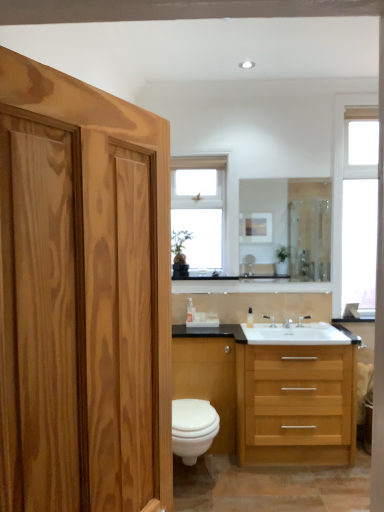
Identify the location of white plastic soap dispenser at center. Image resolution: width=384 pixels, height=512 pixels. (250, 318).

What do you see at coordinates (193, 428) in the screenshot?
I see `white glossy toilet at lower center` at bounding box center [193, 428].

The image size is (384, 512). What do you see at coordinates (266, 396) in the screenshot? I see `light wood/finish sink at lower right` at bounding box center [266, 396].

In order to face silver metallic faucet at sink right, marked as the second faucet in a left-to-right arrangement, should I rotate leftwards or rightwards?

Rotate right and turn 14.730 degrees.

Locate an element on the screen. The height and width of the screenshot is (512, 384). clear glass mirror at center is located at coordinates (286, 227).

The width and height of the screenshot is (384, 512). Describe the element at coordinates (200, 211) in the screenshot. I see `clear glass window at upper center, acting as the 2th window starting from the right` at that location.

At what (x,y) coordinates should I click in order to perform the action: click on white plastic soap dispenser at center. Please return your answer as a coordinate pair (x, y). Looking at the image, I should click on (250, 318).

From the image's perspective, is white glass window at upper right, the 1th window positioned from the right, under clear glass mirror at center?

Actually, white glass window at upper right, the 1th window positioned from the right, appears above clear glass mirror at center in the image.

In terms of width, does white glass window at upper right, which appears as the 2th window when viewed from the left, look wider or thinner when compared to clear glass mirror at center?

In the image, white glass window at upper right, which appears as the 2th window when viewed from the left, appears to be wider than clear glass mirror at center.

Is white glass window at upper right, the 1th window positioned from the right, positioned with its back to clear glass mirror at center?

white glass window at upper right, the 1th window positioned from the right, does not have its back to clear glass mirror at center.

Would you say white glass window at upper right, which appears as the 2th window when viewed from the left, contains clear glass mirror at center?

No, clear glass mirror at center is not inside white glass window at upper right, which appears as the 2th window when viewed from the left.

Considering the sizes of objects white plastic soap dispenser at center and silver metallic faucet at sink right, the 1th faucet viewed from the left, in the image provided, who is wider, white plastic soap dispenser at center or silver metallic faucet at sink right, the 1th faucet viewed from the left,?

With larger width is white plastic soap dispenser at center.

Considering the sizes of objects white plastic soap dispenser at center and silver metallic faucet at sink right, the 1th faucet viewed from the left, in the image provided, who is bigger, white plastic soap dispenser at center or silver metallic faucet at sink right, the 1th faucet viewed from the left,?

white plastic soap dispenser at center is bigger.

Considering the positions of point (253, 319) and point (263, 316), is point (253, 319) closer or farther from the camera than point (263, 316)?

Point (253, 319) is positioned closer to the camera compared to point (263, 316).

From a real-world perspective, is white plastic soap dispenser at center positioned under silver metallic faucet at sink right, the 1th faucet viewed from the left, based on gravity?

No.

Is silver metallic faucet at sink right, positioned as the second faucet in right-to-left order, completely or partially outside of white plastic soap dispenser at center?

That's correct, silver metallic faucet at sink right, positioned as the second faucet in right-to-left order, is outside of white plastic soap dispenser at center.

Is silver metallic faucet at sink right, the 1th faucet viewed from the left, at the left side of white plastic soap dispenser at center?

No, silver metallic faucet at sink right, the 1th faucet viewed from the left, is not to the left of white plastic soap dispenser at center.

Is silver metallic faucet at sink right, positioned as the second faucet in right-to-left order, positioned with its back to white plastic soap dispenser at center?

silver metallic faucet at sink right, positioned as the second faucet in right-to-left order, is not turned away from white plastic soap dispenser at center.

Locate an element on the screen. Image resolution: width=384 pixels, height=512 pixels. toiletry located behind the white glass window at upper right, the 1th window positioned from the right is located at coordinates (250, 318).

Looking at this image, considering the positions of objects white glass window at upper right, the 1th window positioned from the right, and white plastic soap dispenser at center in the image provided, who is in front, white glass window at upper right, the 1th window positioned from the right, or white plastic soap dispenser at center?

white glass window at upper right, the 1th window positioned from the right, is more forward.

Can you confirm if white glass window at upper right, which appears as the 2th window when viewed from the left, is positioned to the left of white plastic soap dispenser at center?

No, white glass window at upper right, which appears as the 2th window when viewed from the left, is not to the left of white plastic soap dispenser at center.

From a real-world perspective, is white glass window at upper right, which appears as the 2th window when viewed from the left, physically above white plastic soap dispenser at center?

Yes.

Based on the photo, does clear glass window at upper center, acting as the 2th window starting from the right, appear on the left side of white glass window at upper right, which appears as the 2th window when viewed from the left?

Yes, clear glass window at upper center, acting as the 2th window starting from the right, is to the left of white glass window at upper right, which appears as the 2th window when viewed from the left.

Is white glass window at upper right, the 1th window positioned from the right, inside clear glass window at upper center, the 1th window in the left-to-right sequence?

That's incorrect, white glass window at upper right, the 1th window positioned from the right, is not inside clear glass window at upper center, the 1th window in the left-to-right sequence.

Can you tell me how much clear glass window at upper center, the 1th window in the left-to-right sequence, and white glass window at upper right, the 1th window positioned from the right, differ in facing direction?

The angular difference between clear glass window at upper center, the 1th window in the left-to-right sequence, and white glass window at upper right, the 1th window positioned from the right, is 0.744 degrees.

Between clear glass window at upper center, acting as the 2th window starting from the right, and white glass window at upper right, the 1th window positioned from the right, which one is positioned in front?

white glass window at upper right, the 1th window positioned from the right.

Which object is more forward, clear glass mirror at center or silver metallic faucet at sink right, which appears as the first faucet when viewed from the right?

silver metallic faucet at sink right, which appears as the first faucet when viewed from the right, is closer to the camera.

Choose the correct answer: Is clear glass mirror at center inside silver metallic faucet at sink right, marked as the second faucet in a left-to-right arrangement, or outside it?

clear glass mirror at center is outside silver metallic faucet at sink right, marked as the second faucet in a left-to-right arrangement.

Consider the image. How distant is clear glass mirror at center from silver metallic faucet at sink right, marked as the second faucet in a left-to-right arrangement?

A distance of 32.63 inches exists between clear glass mirror at center and silver metallic faucet at sink right, marked as the second faucet in a left-to-right arrangement.

What's the angular difference between white glossy cabinet at lower center and clear glass window at upper center, acting as the 2th window starting from the right,'s facing directions?

The facing directions of white glossy cabinet at lower center and clear glass window at upper center, acting as the 2th window starting from the right, are 0.317 degrees apart.

Is white glossy cabinet at lower center far from clear glass window at upper center, acting as the 2th window starting from the right?

No.

Does white glossy cabinet at lower center have a lesser height compared to clear glass window at upper center, acting as the 2th window starting from the right?

Yes.

From a real-world perspective, is white glossy cabinet at lower center positioned under clear glass window at upper center, acting as the 2th window starting from the right, based on gravity?

Correct, in the physical world, white glossy cabinet at lower center is lower than clear glass window at upper center, acting as the 2th window starting from the right.

The width and height of the screenshot is (384, 512). What are the coordinates of `mirror below the white glass window at upper right, which appears as the 2th window when viewed from the left (from a real-world perspective)` in the screenshot? It's located at (286, 227).

Locate an element on the screen. faucet that is the 2nd one when counting backward from the white plastic soap dispenser at center is located at coordinates (270, 320).

Looking at the image, which one is located further to silver metallic faucet at sink right, which appears as the first faucet when viewed from the right, white plastic soap dispenser at center or light wood/finish sink at lower right?

light wood/finish sink at lower right is positioned further to the anchor silver metallic faucet at sink right, which appears as the first faucet when viewed from the right.

Looking at the image, which one is located further to white glossy cabinet at lower center, white glass window at upper right, which appears as the 2th window when viewed from the left, or white plastic soap dispenser at center?

Based on the image, white glass window at upper right, which appears as the 2th window when viewed from the left, appears to be further to white glossy cabinet at lower center.

Considering their positions, is white plastic soap dispenser at center positioned further to light wood/finish sink at lower right than white glass window at upper right, which appears as the 2th window when viewed from the left?

white glass window at upper right, which appears as the 2th window when viewed from the left, lies further to light wood/finish sink at lower right than the other object.

Looking at the image, which one is located further to white glossy toilet at lower center, clear glass window at upper center, acting as the 2th window starting from the right, or silver metallic faucet at sink right, marked as the second faucet in a left-to-right arrangement?

Result: The object further to white glossy toilet at lower center is clear glass window at upper center, acting as the 2th window starting from the right.

When comparing their distances from white glossy cabinet at lower center, does clear glass mirror at center or white glass window at upper right, the 1th window positioned from the right, seem closer?

Based on the image, clear glass mirror at center appears to be nearer to white glossy cabinet at lower center.

Based on the photo, based on their spatial positions, is clear glass mirror at center or white glass window at upper right, which appears as the 2th window when viewed from the left, further from light wood/finish sink at lower right?

clear glass mirror at center lies further to light wood/finish sink at lower right than the other object.

Based on their spatial positions, is clear glass window at upper center, the 1th window in the left-to-right sequence, or clear glass mirror at center further from silver metallic faucet at sink right, positioned as the second faucet in right-to-left order?

clear glass window at upper center, the 1th window in the left-to-right sequence, lies further to silver metallic faucet at sink right, positioned as the second faucet in right-to-left order, than the other object.

Which object lies nearer to the anchor point white plastic soap dispenser at center, white glossy toilet at lower center or light wood/finish sink at lower right?

Based on the image, light wood/finish sink at lower right appears to be nearer to white plastic soap dispenser at center.

Locate an element on the screen. The height and width of the screenshot is (512, 384). mirror between white glass window at upper right, which appears as the 2th window when viewed from the left, and white plastic soap dispenser at center, in the vertical direction is located at coordinates (286, 227).

Locate an element on the screen. This screenshot has height=512, width=384. cabinetry between white glass window at upper right, the 1th window positioned from the right, and light wood/finish sink at lower right vertically is located at coordinates [x=208, y=381].

The image size is (384, 512). I want to click on cabinetry between clear glass mirror at center and light wood/finish sink at lower right in the vertical direction, so pos(208,381).

Where is `window between white glass window at upper right, which appears as the 2th window when viewed from the left, and white glossy cabinet at lower center vertically`? The width and height of the screenshot is (384, 512). window between white glass window at upper right, which appears as the 2th window when viewed from the left, and white glossy cabinet at lower center vertically is located at coordinates (200, 211).